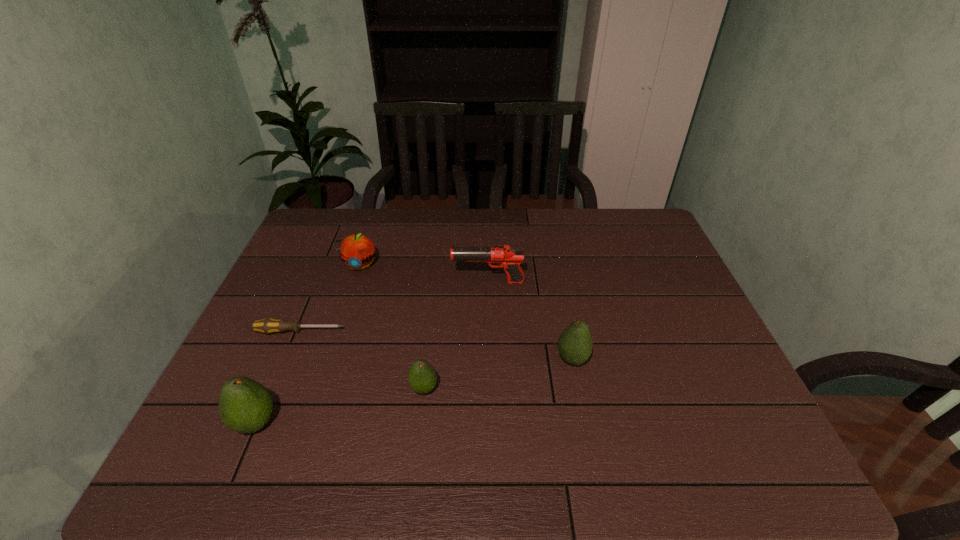
Identify the location of the tallest avocado. The height and width of the screenshot is (540, 960). (245, 406).

You are a GUI agent. You are given a task and a screenshot of the screen. Output one action in this format:
    pyautogui.click(x=<x>, y=<y>)
    Task: Click on the nearest object
    
    Given the screenshot: What is the action you would take?
    pyautogui.click(x=245, y=406)

Where is `the fourth object from left to right`? This screenshot has width=960, height=540. the fourth object from left to right is located at coordinates (422, 377).

Find the location of `the second avocado from right to left`. the second avocado from right to left is located at coordinates (422, 377).

Where is `the rightmost object`? The image size is (960, 540). the rightmost object is located at coordinates (575, 344).

Identify the location of the farthest avocado. The height and width of the screenshot is (540, 960). (575, 344).

The width and height of the screenshot is (960, 540). Identify the location of the second object from right to left. 505,256.

Locate an element on the screen. the second farthest object is located at coordinates [505, 256].

Locate an element on the screen. The height and width of the screenshot is (540, 960). screwdriver is located at coordinates (268, 326).

The height and width of the screenshot is (540, 960). What are the coordinates of `the shortest object` in the screenshot? It's located at (268, 326).